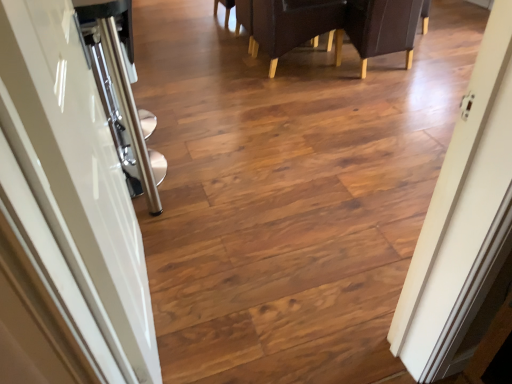
This screenshot has width=512, height=384. Find the location of `unoccupied area in front of dark brown leather armchair at upper center, acting as the first armchair starting from the left`. unoccupied area in front of dark brown leather armchair at upper center, acting as the first armchair starting from the left is located at coordinates (296, 96).